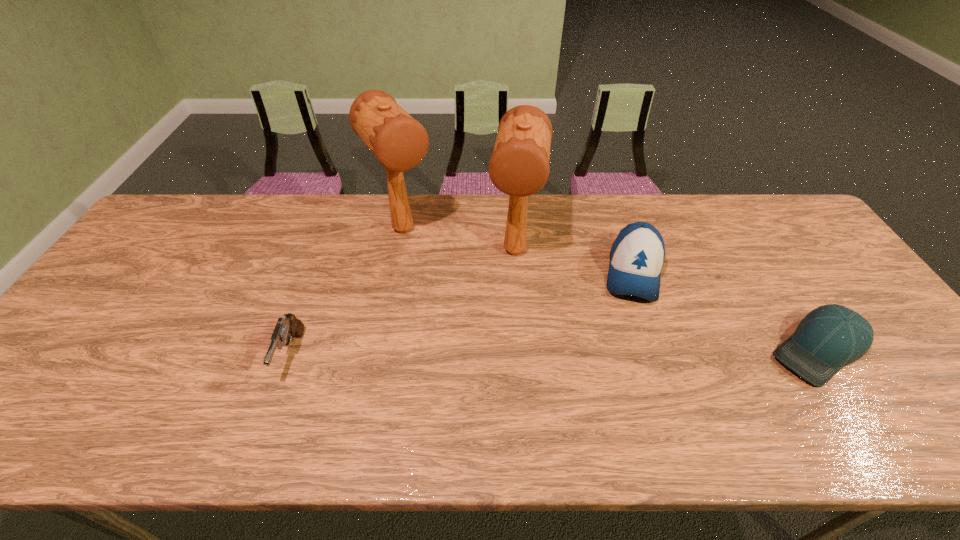
The width and height of the screenshot is (960, 540). I want to click on free space located 0.250m on the front-facing side of the taller baseball cap, so (631, 386).

The width and height of the screenshot is (960, 540). In order to click on vacant space located 0.270m on the front-facing side of the taller baseball cap in this screenshot , I will do `click(630, 394)`.

What are the coordinates of `vacant region located on the strike surface of the left mallet` in the screenshot? It's located at (482, 338).

Where is `vacant area situated 0.100m on the strike surface of the left mallet`? Image resolution: width=960 pixels, height=540 pixels. vacant area situated 0.100m on the strike surface of the left mallet is located at coordinates (433, 272).

At what (x,y) coordinates should I click in order to perform the action: click on free location located 0.070m on the strike surface of the left mallet. Please return your answer as a coordinate pair (x, y). Looking at the image, I should click on (429, 266).

Where is `free space located 0.280m on the strike surface of the right mallet`? The image size is (960, 540). free space located 0.280m on the strike surface of the right mallet is located at coordinates (501, 361).

Locate an element on the screen. free point located 0.320m on the strike surface of the right mallet is located at coordinates (499, 376).

The height and width of the screenshot is (540, 960). What are the coordinates of `vacant space located on the strike surface of the right mallet` in the screenshot? It's located at (495, 399).

The height and width of the screenshot is (540, 960). Find the location of `pistol that is positioned at the near edge`. pistol that is positioned at the near edge is located at coordinates (289, 326).

You are a GUI agent. You are given a task and a screenshot of the screen. Output one action in this format:
    pyautogui.click(x=<x>, y=<y>)
    Task: Click on the baseball cap that is positioned at the near edge
    The width and height of the screenshot is (960, 540).
    Given the screenshot: What is the action you would take?
    pyautogui.click(x=828, y=338)